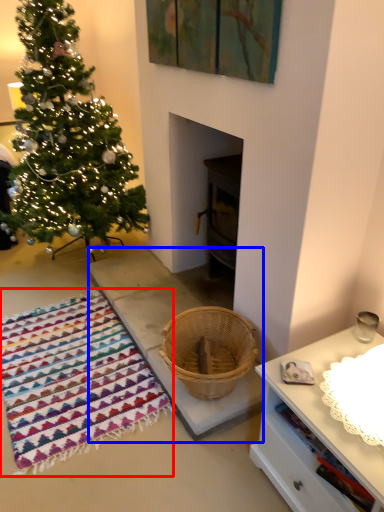
Question: Which point is further to the camera, blanket (highlighted by a red box) or concrete (highlighted by a blue box)?

Choices:
 (A) blanket
 (B) concrete

Answer: (B)